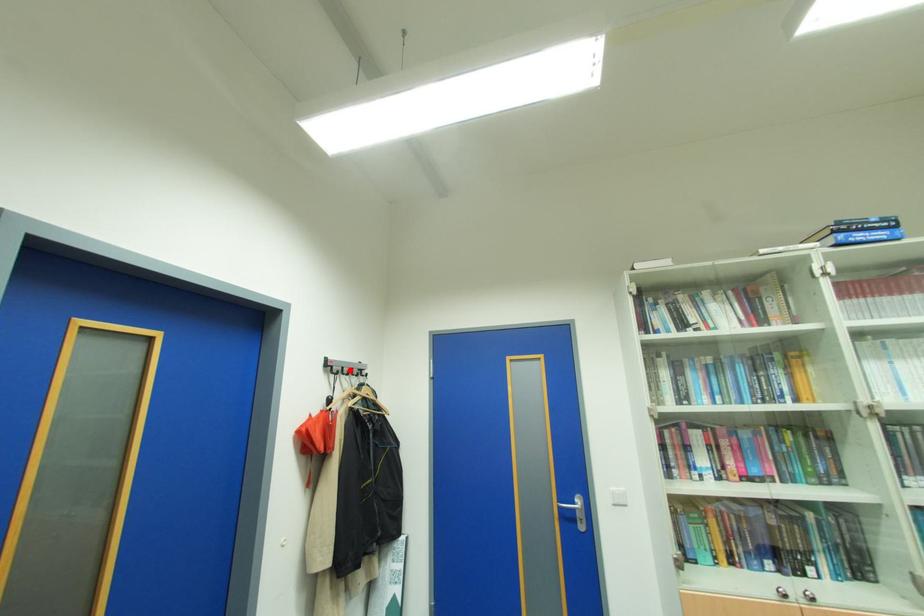
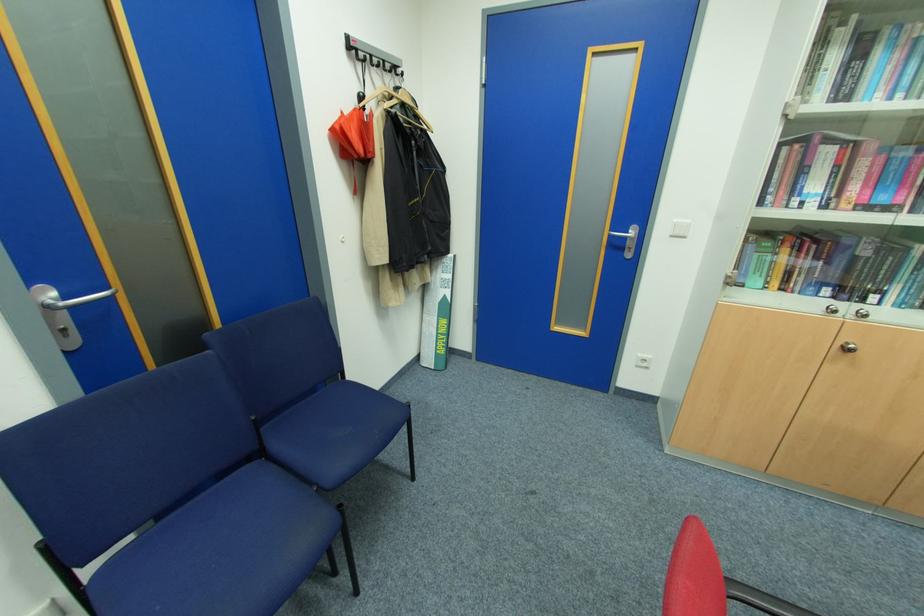
Question: I am providing you with two images of the same scene from different viewpoints. A red point is marked on the first image. Can you still see the location of the red point in image 2?

Choices:
 (A) Yes
 (B) No

Answer: (A)